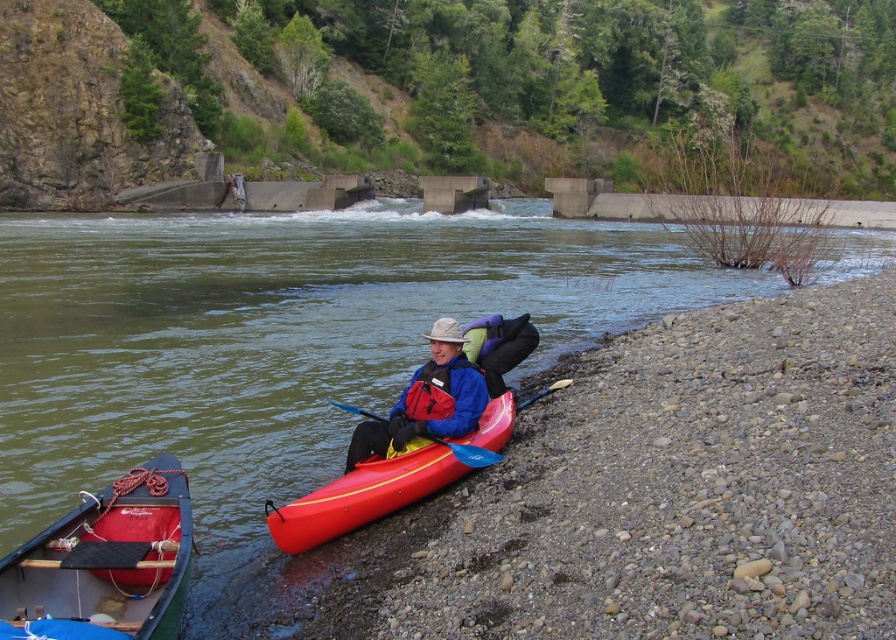
You are standing at the point with coordinates point (481, 353) and want to move towards the point with coordinates point (135, 292). Based on the scene, is the point you want to reach in front of or behind you?

The point (135, 292) is behind point (481, 353), so the point you want to reach is behind you.

You are navigating a kayak along the river and see two points marked on your map. The first point is at coordinate point (82, 541) and the second is at point (67, 554). According to the image, which point is closer to the dam or spillway structure in the background?

Point (67, 554) is closer to the dam or spillway structure because it is in front of point (82, 541), which is behind it.